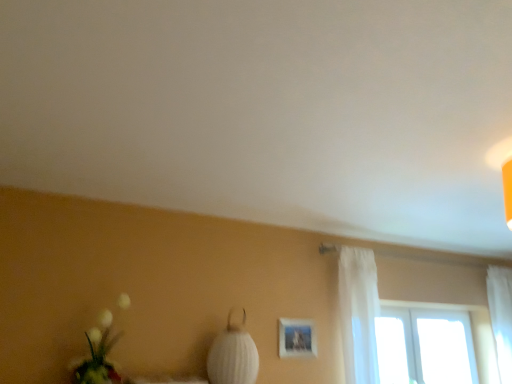
Question: From the image's perspective, is white fabric lampshade at center above white fluffy bouquet at lower left?

Choices:
 (A) yes
 (B) no

Answer: (B)

Question: Is white fabric lampshade at center located outside white fluffy bouquet at lower left?

Choices:
 (A) no
 (B) yes

Answer: (B)

Question: Is white fabric lampshade at center at the right side of white fluffy bouquet at lower left?

Choices:
 (A) yes
 (B) no

Answer: (A)

Question: Does white fabric lampshade at center have a greater height compared to white fluffy bouquet at lower left?

Choices:
 (A) yes
 (B) no

Answer: (B)

Question: Can you confirm if white fabric lampshade at center is positioned to the left of white fluffy bouquet at lower left?

Choices:
 (A) no
 (B) yes

Answer: (A)

Question: Does white fabric lampshade at center contain white fluffy bouquet at lower left?

Choices:
 (A) yes
 (B) no

Answer: (B)

Question: Are white sheer curtain at right, arranged as the 2th curtain when viewed from the right, and white fluffy bouquet at lower left located far from each other?

Choices:
 (A) no
 (B) yes

Answer: (B)

Question: Does white sheer curtain at right, the second curtain positioned from the back, come behind white fluffy bouquet at lower left?

Choices:
 (A) yes
 (B) no

Answer: (A)

Question: Is white sheer curtain at right, arranged as the 1th curtain when viewed from the front, smaller than white fluffy bouquet at lower left?

Choices:
 (A) yes
 (B) no

Answer: (B)

Question: Can you confirm if white sheer curtain at right, marked as the first curtain in a left-to-right arrangement, is shorter than white fluffy bouquet at lower left?

Choices:
 (A) no
 (B) yes

Answer: (A)

Question: Is white sheer curtain at right, marked as the first curtain in a left-to-right arrangement, thinner than white fluffy bouquet at lower left?

Choices:
 (A) no
 (B) yes

Answer: (B)

Question: Does white sheer curtain at right, arranged as the 1th curtain when viewed from the front, appear on the left side of white fluffy bouquet at lower left?

Choices:
 (A) yes
 (B) no

Answer: (B)

Question: Does white fabric lampshade at center have a lesser width compared to white sheer curtain at right, marked as the 1th curtain in a back-to-front arrangement?

Choices:
 (A) yes
 (B) no

Answer: (B)